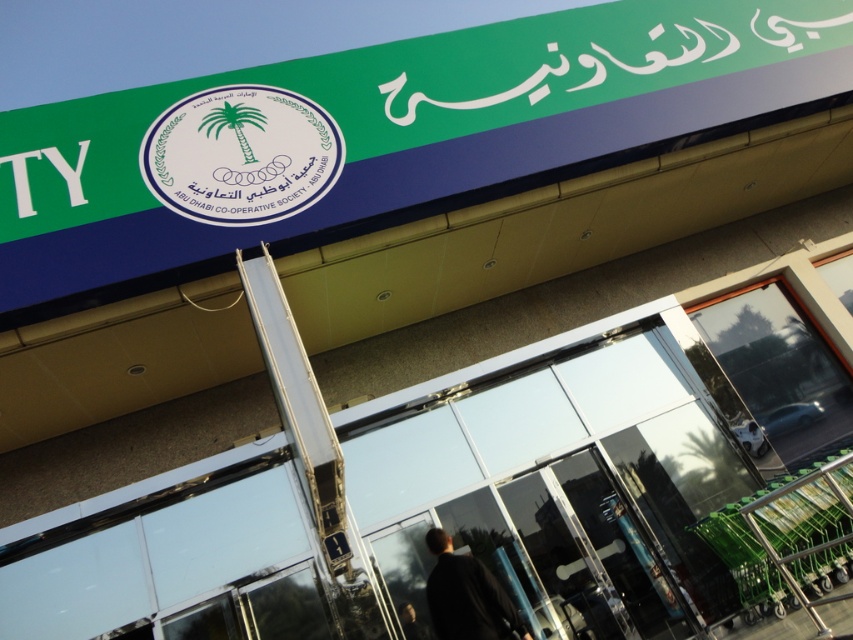
Is the position of green plastic signboard at upper center less distant than that of white glossy emblem at center?

Yes, green plastic signboard at upper center is closer to the viewer.

Can you confirm if green plastic signboard at upper center is thinner than white glossy emblem at center?

Yes, green plastic signboard at upper center is thinner than white glossy emblem at center.

Measure the distance between green plastic signboard at upper center and camera.

The distance of green plastic signboard at upper center from camera is 16.29 feet.

Identify the location of green plastic signboard at upper center. The width and height of the screenshot is (853, 640). (381, 131).

Can you confirm if white glossy emblem at center is positioned to the left of black matte jacket at lower center?

Yes, white glossy emblem at center is to the left of black matte jacket at lower center.

Between white glossy emblem at center and black matte jacket at lower center, which one appears on the right side from the viewer's perspective?

Positioned to the right is black matte jacket at lower center.

Between point (305, 168) and point (477, 618), which one is positioned behind?

The point (305, 168) is more distant.

Identify the location of white glossy emblem at center. (241, 154).

Does green plastic signboard at upper center come behind black matte jacket at lower center?

Yes, green plastic signboard at upper center is further from the viewer.

Between green plastic signboard at upper center and black matte jacket at lower center, which one is positioned lower?

Positioned lower is black matte jacket at lower center.

Does point (109, 278) come behind point (445, 624)?

Yes, point (109, 278) is behind point (445, 624).

Image resolution: width=853 pixels, height=640 pixels. I want to click on green plastic signboard at upper center, so click(x=381, y=131).